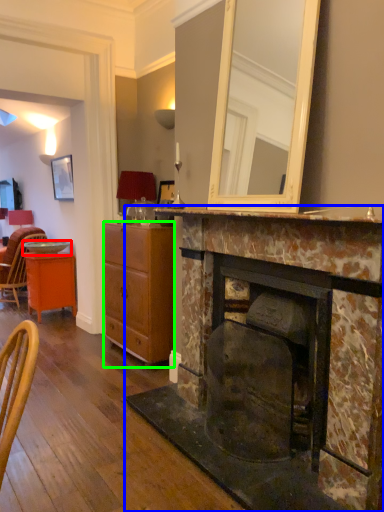
Question: Which object is positioned farthest from plate (highlighted by a red box)? Select from fireplace (highlighted by a blue box) and cabinetry (highlighted by a green box).

Choices:
 (A) fireplace
 (B) cabinetry

Answer: (A)